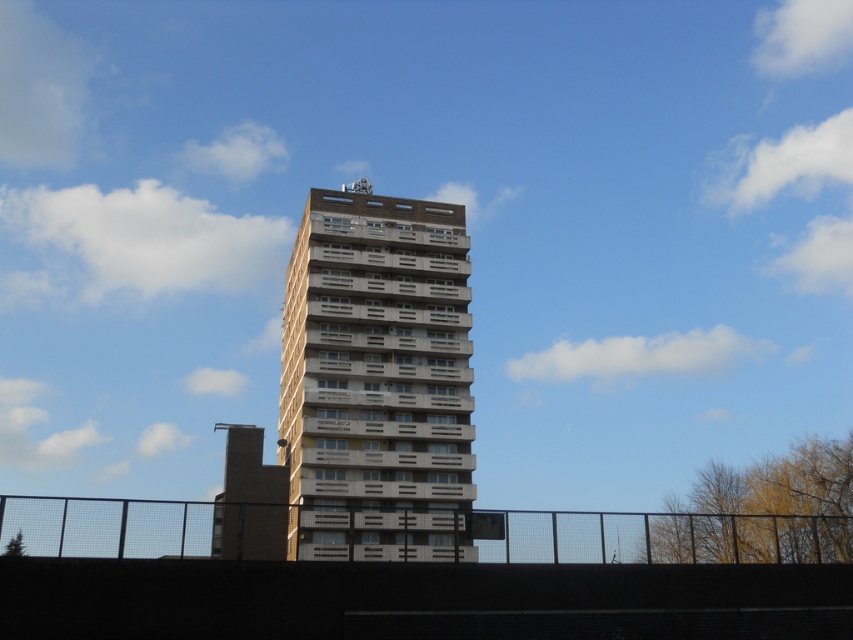
Is beige concrete tower block at center above black metal fence at lower center?

Yes, beige concrete tower block at center is above black metal fence at lower center.

Find the location of a particular element. The width and height of the screenshot is (853, 640). beige concrete tower block at center is located at coordinates (378, 376).